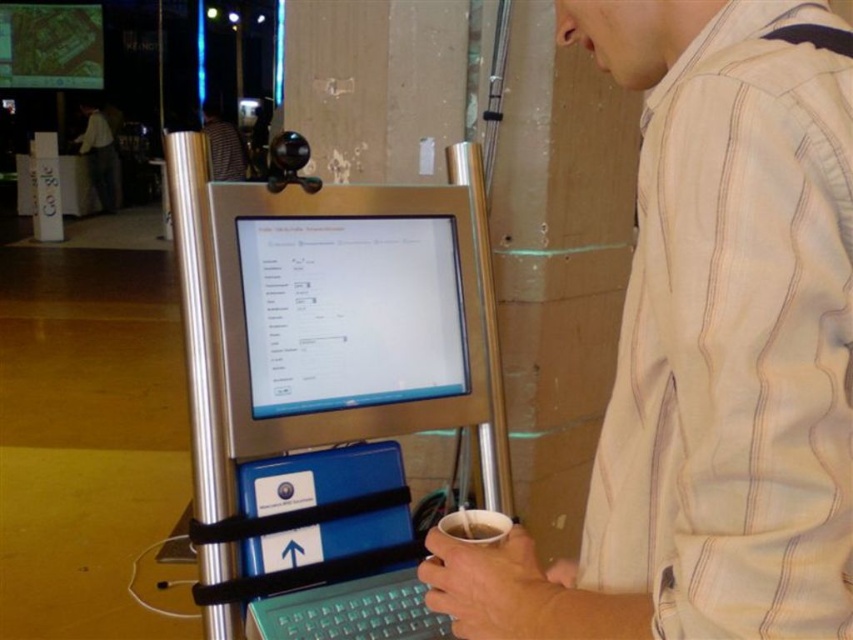
Does point (210, 189) come in front of point (224, 145)?

Yes.

Who is positioned more to the left, silver metallic computer at center or striped shirt at center?

Positioned to the left is striped shirt at center.

Find the location of a particular element. The image size is (853, 640). silver metallic computer at center is located at coordinates (331, 390).

Does light beige striped shirt at center have a larger size compared to light beige striped shirt at upper right?

Incorrect, light beige striped shirt at center is not larger than light beige striped shirt at upper right.

Is point (677, 452) in front of point (86, 108)?

Yes, it is.

Is point (814, 472) positioned after point (91, 179)?

No, it is not.

You are a GUI agent. You are given a task and a screenshot of the screen. Output one action in this format:
    pyautogui.click(x=<x>, y=<y>)
    Task: Click on the light beige striped shirt at center
    This screenshot has height=640, width=853.
    Given the screenshot: What is the action you would take?
    pyautogui.click(x=709, y=349)

Which is behind, point (78, 144) or point (489, 525)?

Positioned behind is point (78, 144).

Describe the element at coordinates (99, 156) in the screenshot. I see `light beige striped shirt at upper right` at that location.

Which is in front, point (91, 150) or point (473, 529)?

Point (473, 529)

The width and height of the screenshot is (853, 640). I want to click on light beige striped shirt at upper right, so (x=99, y=156).